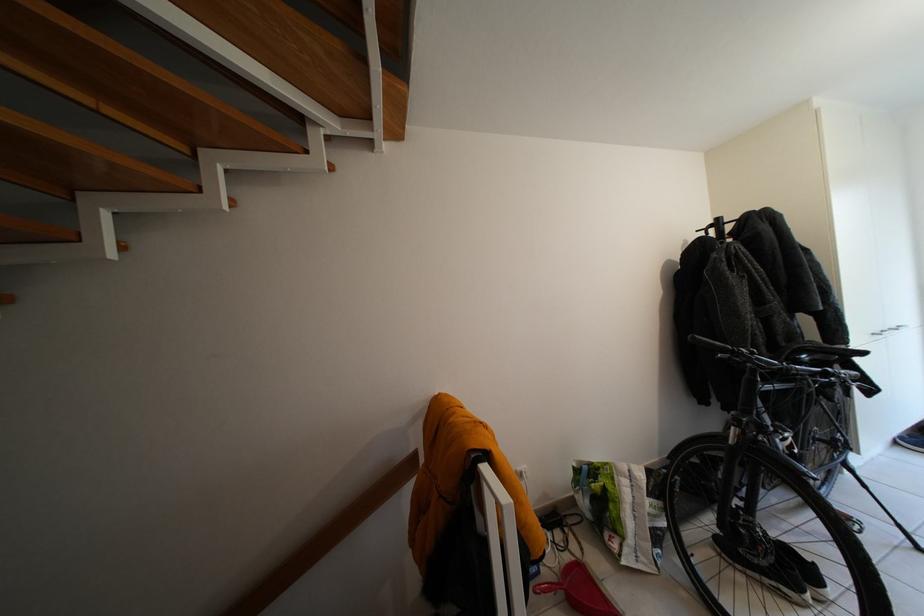
Describe the element at coordinates (490, 499) in the screenshot. I see `the white cabinet handle` at that location.